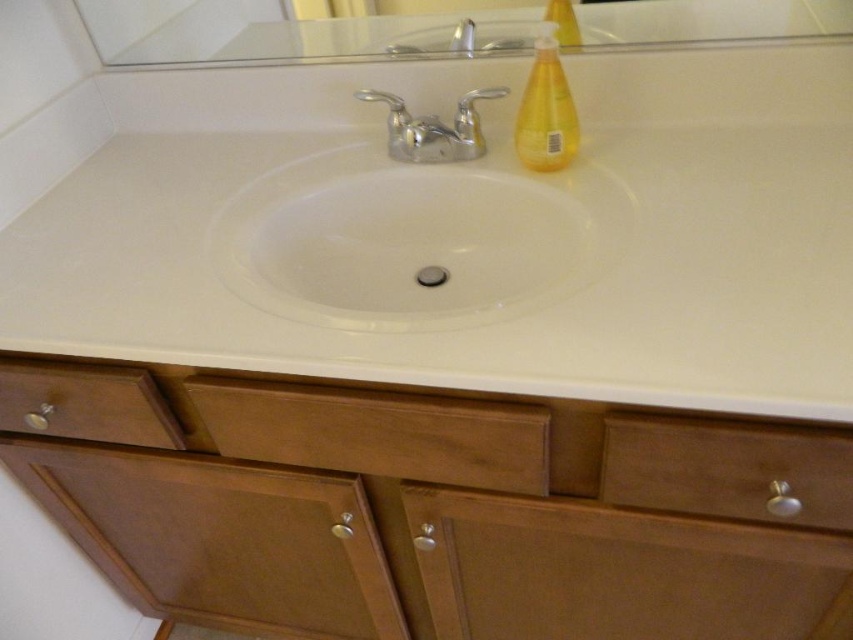
Who is positioned more to the right, wooden cabinet at lower center or wooden drawer at lower right?

From the viewer's perspective, wooden drawer at lower right appears more on the right side.

Is point (136, 493) farther from camera compared to point (746, 502)?

That is True.

Where is `wooden cabinet at lower center`? wooden cabinet at lower center is located at coordinates (432, 508).

Does wooden drawer at center appear over satin nickel faucet at upper center?

No, wooden drawer at center is not above satin nickel faucet at upper center.

You are a GUI agent. You are given a task and a screenshot of the screen. Output one action in this format:
    pyautogui.click(x=<x>, y=<y>)
    Task: Click on the wooden drawer at center
    
    Given the screenshot: What is the action you would take?
    pyautogui.click(x=376, y=433)

Does satin nickel faucet at upper center have a lesser height compared to matte gray soap at center?

No, satin nickel faucet at upper center is not shorter than matte gray soap at center.

Who is higher up, satin nickel faucet at upper center or matte gray soap at center?

satin nickel faucet at upper center is higher up.

The height and width of the screenshot is (640, 853). I want to click on satin nickel faucet at upper center, so click(x=463, y=35).